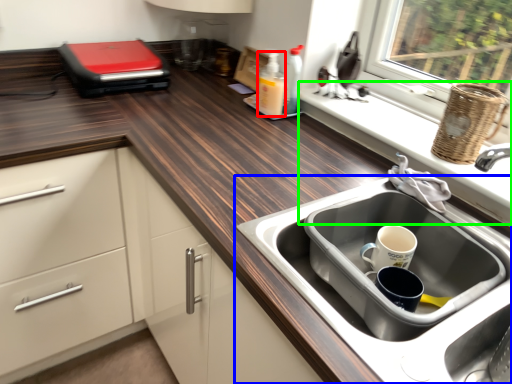
Question: Based on their relative distances, which object is farther from bottle (highlighted by a red box)? Choose from sink (highlighted by a blue box) and window sill (highlighted by a green box).

Choices:
 (A) sink
 (B) window sill

Answer: (A)